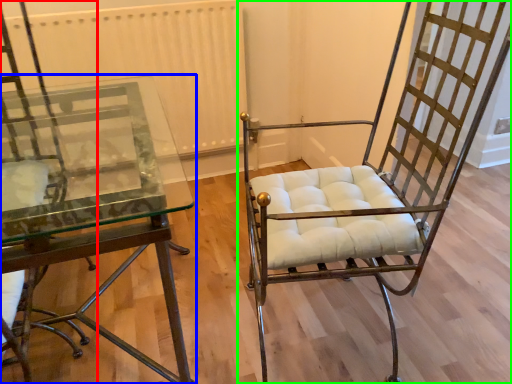
Question: Considering the real-world distances, which object is closest to chair (highlighted by a red box)? table (highlighted by a blue box) or chair (highlighted by a green box).

Choices:
 (A) table
 (B) chair

Answer: (A)